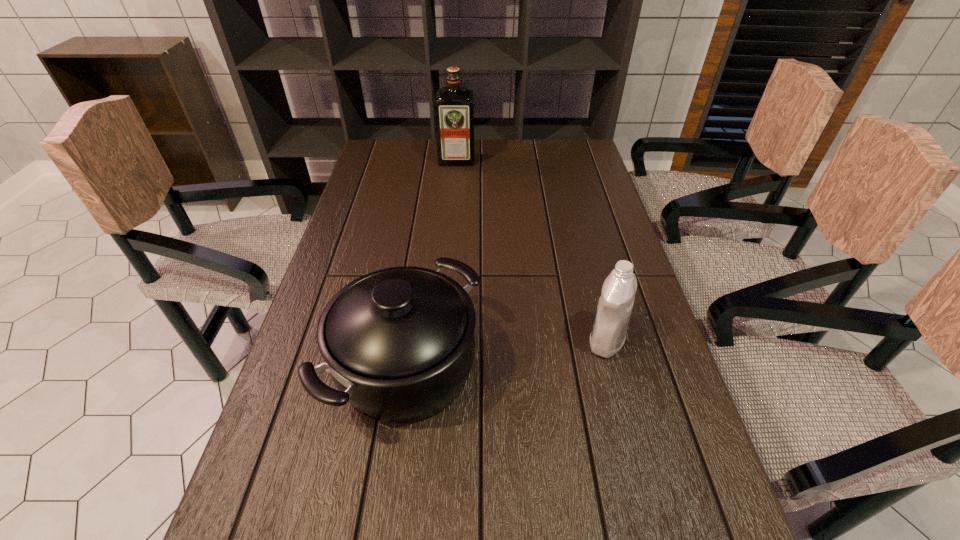
Image resolution: width=960 pixels, height=540 pixels. Find the location of `liquor`. liquor is located at coordinates (454, 106).

Locate an element on the screen. the tallest object is located at coordinates (454, 106).

Locate an element on the screen. The image size is (960, 540). saucepan is located at coordinates (398, 343).

Locate an element on the screen. This screenshot has width=960, height=540. the rightmost object is located at coordinates (615, 304).

Find the location of a particular element. The width and height of the screenshot is (960, 540). vacant space located 0.290m on the front label of the farthest object is located at coordinates (452, 215).

Find the location of a particular element. vacant space situated 0.130m on the right of the saucepan is located at coordinates (540, 366).

Find the location of a particular element. The image size is (960, 540). free location located 0.080m on the front of the detergent is located at coordinates (619, 393).

Find the location of a particular element. object located at the far edge is located at coordinates (454, 106).

I want to click on object located in the left edge section of the desktop, so click(x=398, y=343).

The width and height of the screenshot is (960, 540). Identify the location of object present at the right edge. (615, 304).